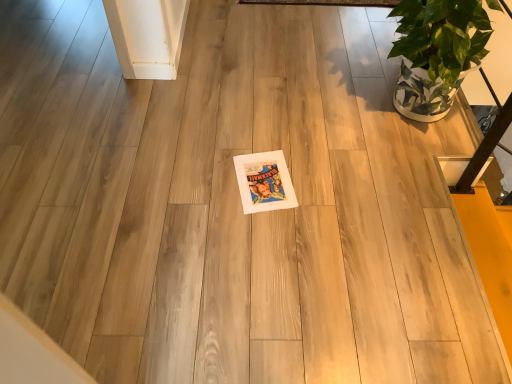
The width and height of the screenshot is (512, 384). Describe the element at coordinates (436, 53) in the screenshot. I see `green leafy plant at upper right` at that location.

This screenshot has width=512, height=384. I want to click on green leafy plant at upper right, so (436, 53).

Where is `green leafy plant at upper right`? The height and width of the screenshot is (384, 512). green leafy plant at upper right is located at coordinates (436, 53).